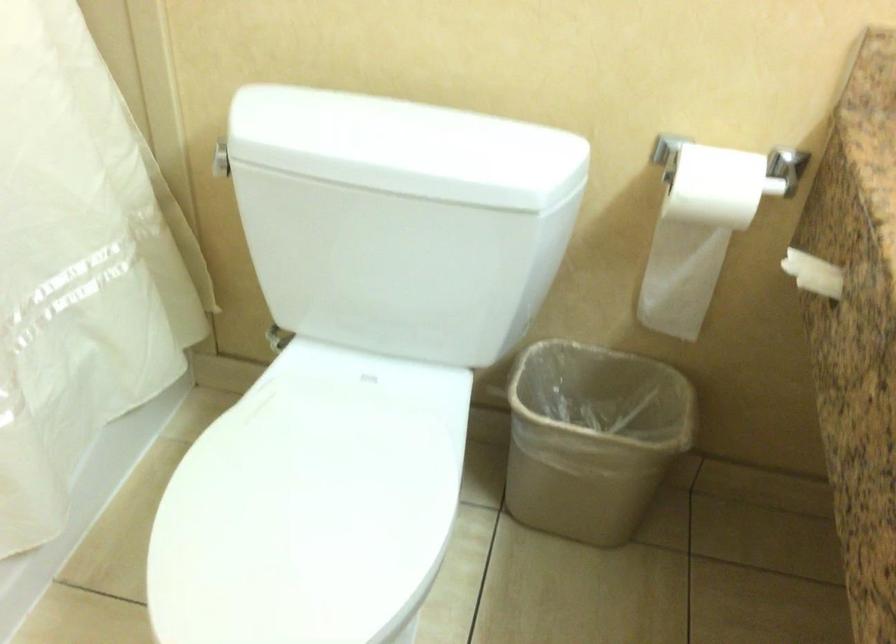
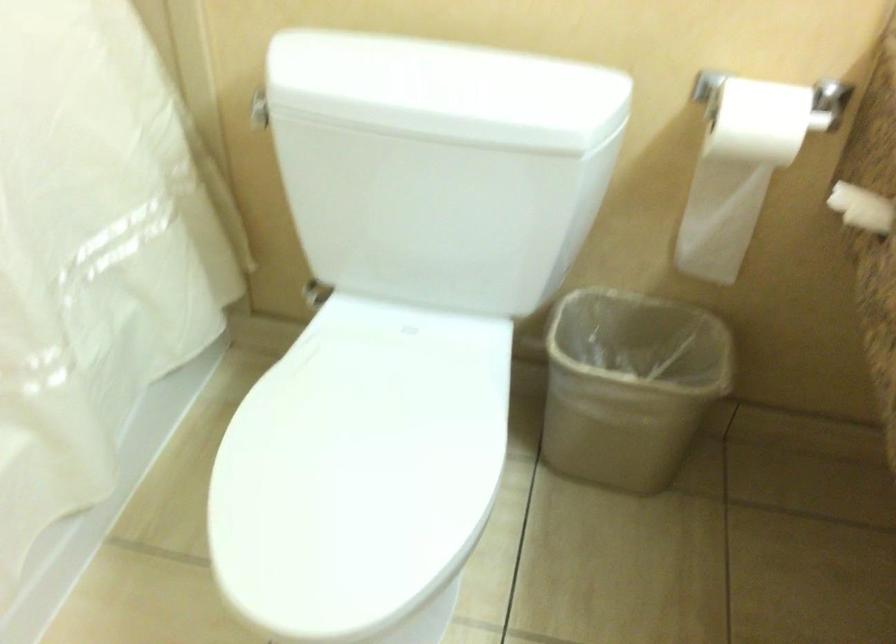
In the second image, find the point that corresponds to (407,144) in the first image.

(446, 90)